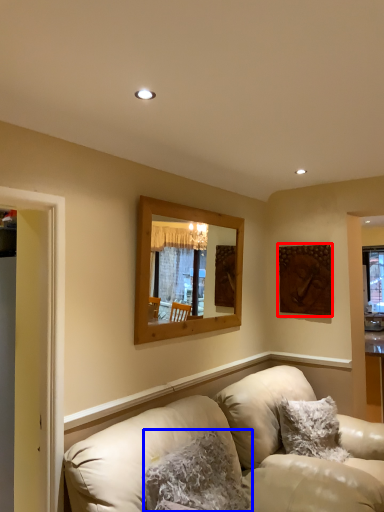
Question: Which point is closer to the camera, picture frame (highlighted by a red box) or pillow (highlighted by a blue box)?

Choices:
 (A) picture frame
 (B) pillow

Answer: (B)